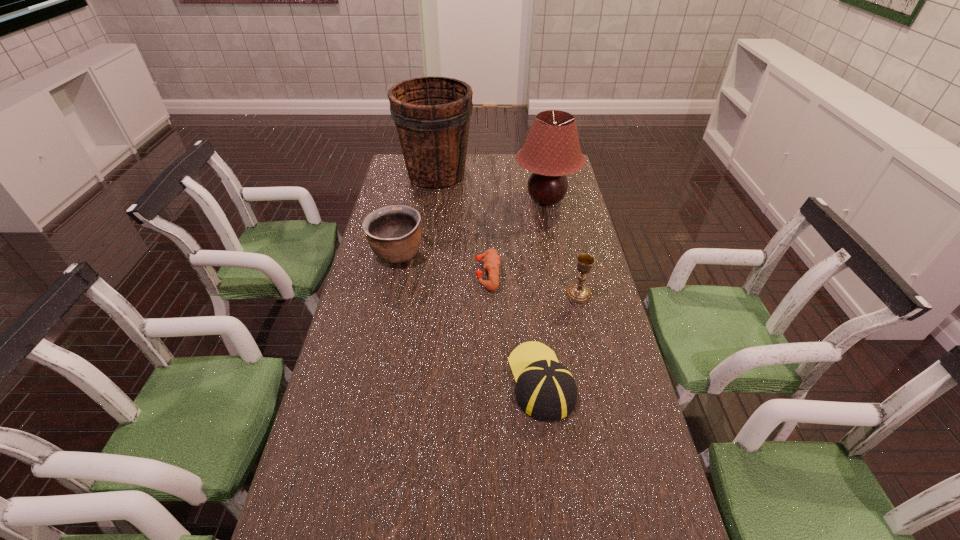
What are the coordinates of `free region located on the front of the pottery` in the screenshot? It's located at (388, 298).

Locate an element on the screen. free point located on the front of the chalice is located at coordinates (590, 345).

Where is `vacant space positioned 0.320m with the brim of the baseball cap facing forward`? This screenshot has height=540, width=960. vacant space positioned 0.320m with the brim of the baseball cap facing forward is located at coordinates (528, 271).

Identify the location of vacant area located 0.320m with the brim of the baseball cap facing forward. This screenshot has height=540, width=960. (528, 271).

This screenshot has height=540, width=960. Identify the location of vacant area situated with the brim of the baseball cap facing forward. (531, 289).

At what (x,y) coordinates should I click in order to perform the action: click on free space located 0.390m with the gloves of the fourth object from right to left facing forward. Please return your answer as a coordinate pair (x, y). This screenshot has width=960, height=540. Looking at the image, I should click on (359, 274).

What are the coordinates of `vacant space situated with the gloves of the fourth object from right to left facing forward` in the screenshot? It's located at (440, 274).

At what (x,y) coordinates should I click in order to perform the action: click on free space located 0.370m with the gloves of the fourth object from right to left facing forward. Please return your answer as a coordinate pair (x, y). Looking at the image, I should click on (365, 274).

I want to click on object at the far edge, so point(432,115).

You are a GUI agent. You are given a task and a screenshot of the screen. Output one action in this format:
    pyautogui.click(x=<x>, y=<y>)
    Task: Click on the bucket that is at the left edge
    The width and height of the screenshot is (960, 540).
    Given the screenshot: What is the action you would take?
    pyautogui.click(x=432, y=115)